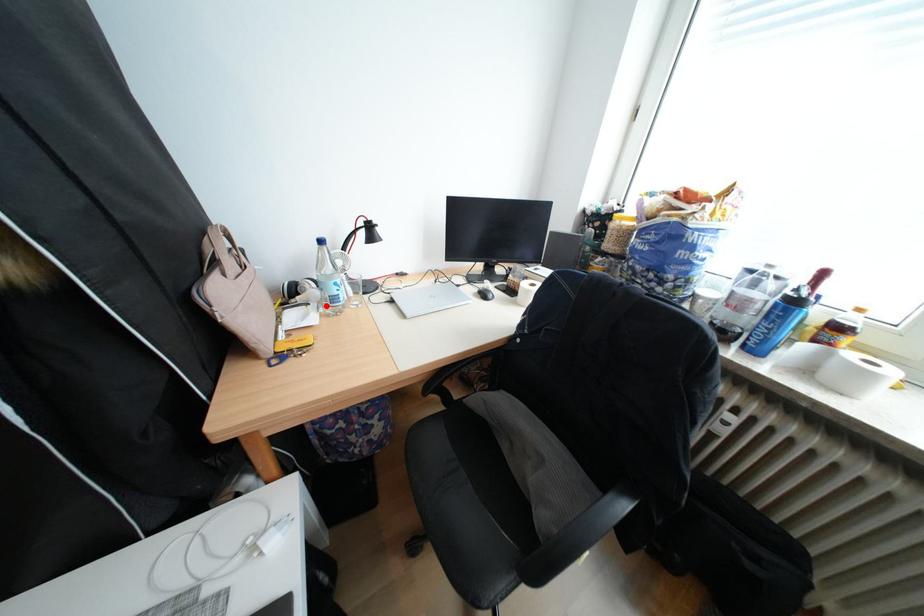
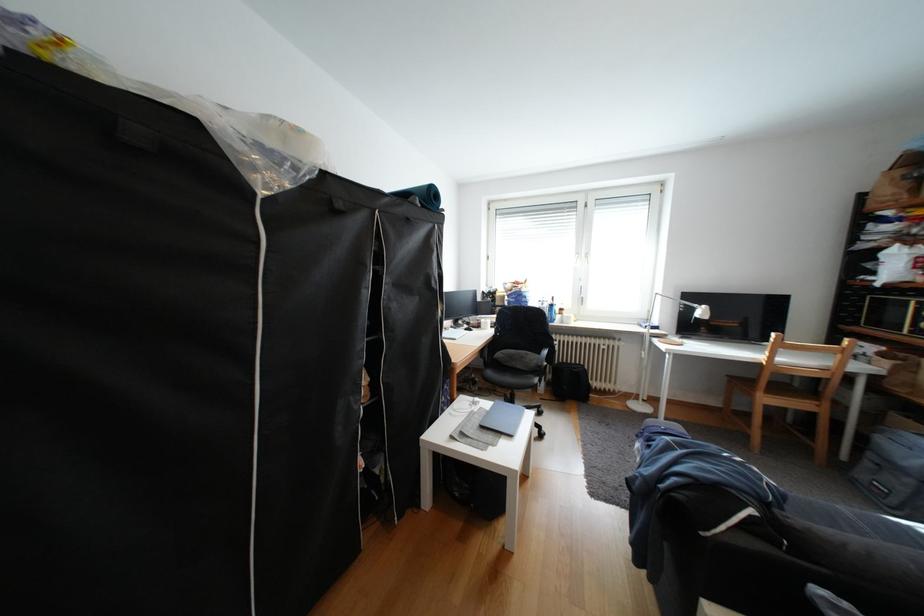
Question: I am providing you with two images of the same scene from different viewpoints. A red point is marked on the first image. Is the red point's position out of view in image 2?

Choices:
 (A) Yes
 (B) No

Answer: (A)